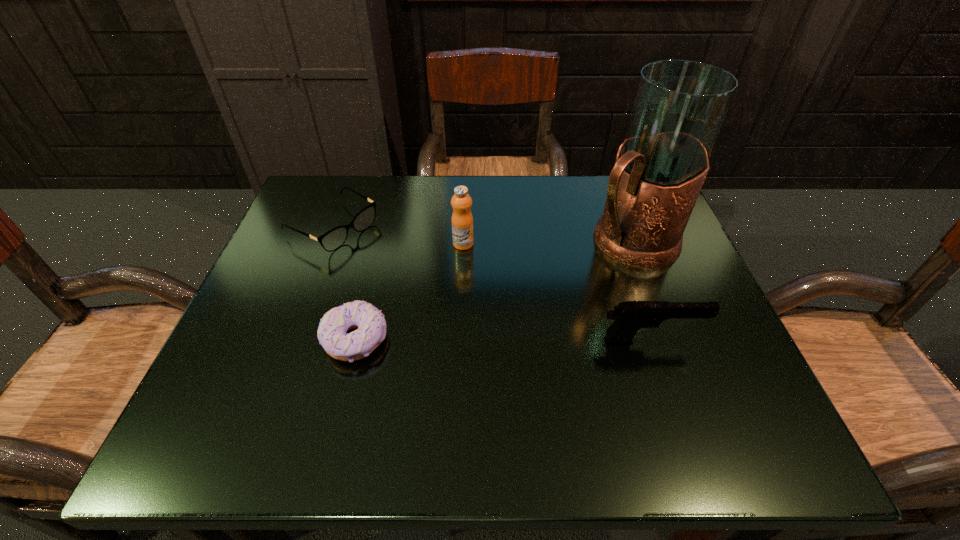
Image resolution: width=960 pixels, height=540 pixels. I want to click on doughnut, so click(370, 323).

At what (x,y) coordinates should I click in order to perform the action: click on pistol. Please return your answer as a coordinate pair (x, y). Looking at the image, I should click on (630, 316).

Identify the location of pitcher. The width and height of the screenshot is (960, 540). click(679, 107).

Identify the location of the third object from right to left. (462, 220).

In order to click on the fourth shortest object in this screenshot , I will do `click(462, 220)`.

Find the location of a particular element. spectacles is located at coordinates (333, 239).

Where is `vacant space located 0.230m on the right of the doughnut`? This screenshot has height=540, width=960. vacant space located 0.230m on the right of the doughnut is located at coordinates (516, 340).

Locate an element on the screen. The height and width of the screenshot is (540, 960). vacant space located with the handle on the side of the tallest object is located at coordinates (522, 317).

Identify the location of vacant region located with the handle on the side of the tallest object. (511, 325).

Where is `vacant space positioned 0.090m with the handle on the side of the tallest object`? The height and width of the screenshot is (540, 960). vacant space positioned 0.090m with the handle on the side of the tallest object is located at coordinates (571, 282).